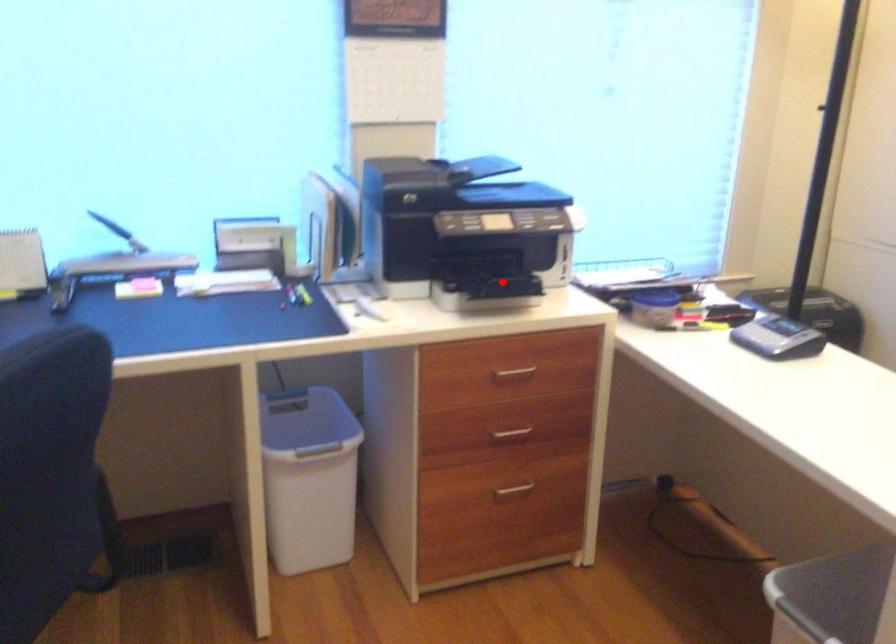
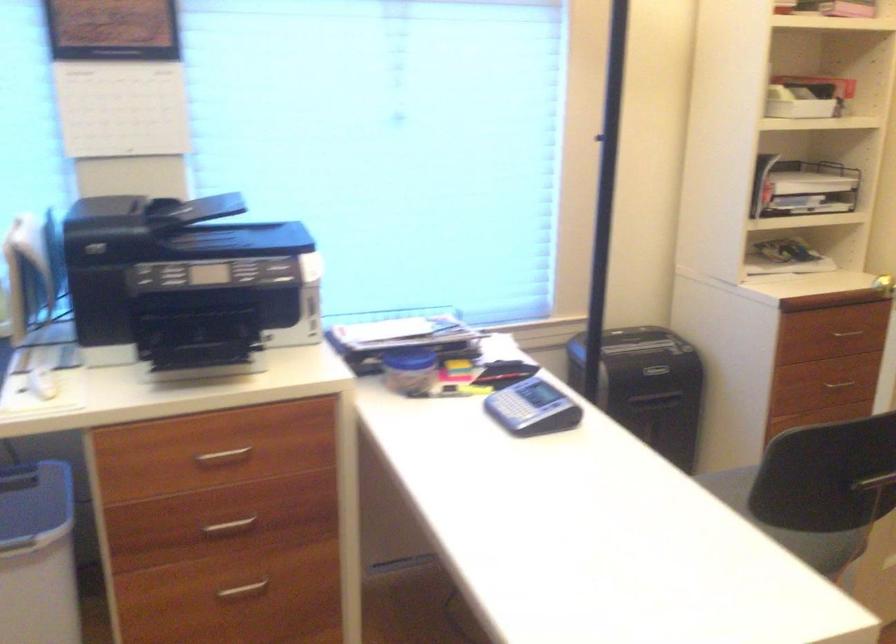
Find the pixel in the second image that matches the highlighted location in the first image.

(197, 351)